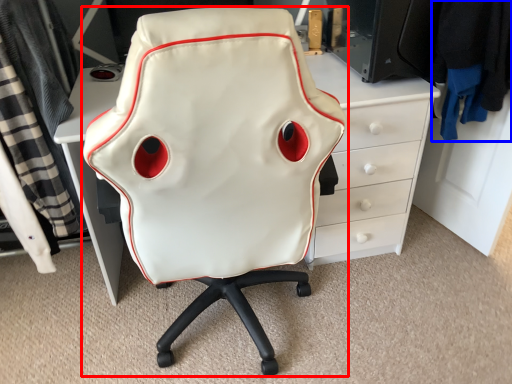
Question: Which point is further to the camera, chair (highlighted by a red box) or clothing (highlighted by a blue box)?

Choices:
 (A) chair
 (B) clothing

Answer: (B)